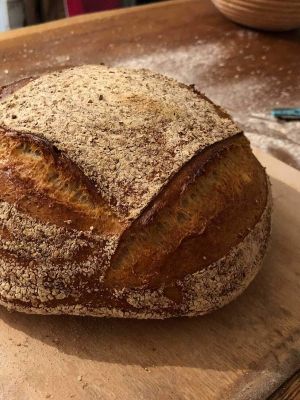
What are the coordinates of `cutting board` in the screenshot? It's located at (248, 338).